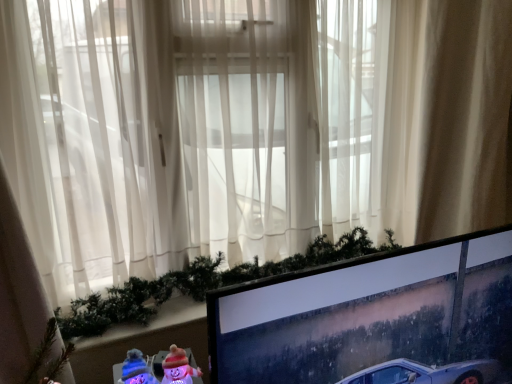
Question: Would you say matte black monitor at lower right is to the left or to the right of beige fabric curtain at right in the picture?

Choices:
 (A) right
 (B) left

Answer: (B)

Question: Is matte black monitor at lower right taller or shorter than beige fabric curtain at right?

Choices:
 (A) tall
 (B) short

Answer: (B)

Question: Looking at the image, does matte black monitor at lower right seem bigger or smaller compared to beige fabric curtain at right?

Choices:
 (A) big
 (B) small

Answer: (B)

Question: Is beige fabric curtain at right in front of or behind matte black monitor at lower right in the image?

Choices:
 (A) front
 (B) behind

Answer: (B)

Question: From the image's perspective, relative to matte black monitor at lower right, is beige fabric curtain at right above or below?

Choices:
 (A) below
 (B) above

Answer: (B)

Question: Is beige fabric curtain at right bigger or smaller than matte black monitor at lower right?

Choices:
 (A) small
 (B) big

Answer: (B)

Question: Is beige fabric curtain at right inside or outside of matte black monitor at lower right?

Choices:
 (A) inside
 (B) outside

Answer: (B)